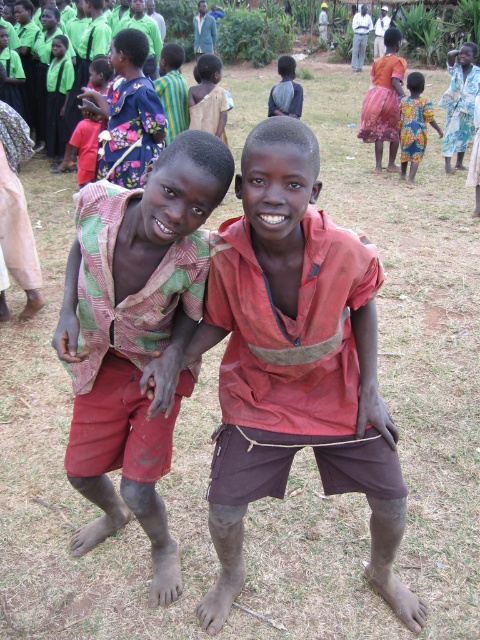
Can you confirm if red matte shirt at center is positioned to the right of multicolored fabric vest at center?

Yes, red matte shirt at center is to the right of multicolored fabric vest at center.

Between red matte shirt at center and multicolored fabric vest at center, which one has more height?

Standing taller between the two is red matte shirt at center.

You are a GUI agent. You are given a task and a screenshot of the screen. Output one action in this format:
    pyautogui.click(x=<x>, y=<y>)
    Task: Click on the red matte shirt at center
    The height and width of the screenshot is (640, 480).
    Given the screenshot: What is the action you would take?
    pyautogui.click(x=296, y=356)

At what (x,y) coordinates should I click in order to perform the action: click on red matte shirt at center. Please return your answer as a coordinate pair (x, y). Image resolution: width=480 pixels, height=640 pixels. Looking at the image, I should click on (296, 356).

Is multicolored fabric vest at center thinner than vibrant floral dress at upper right?

Incorrect, multicolored fabric vest at center's width is not less than vibrant floral dress at upper right's.

Does multicolored fabric vest at center lie behind vibrant floral dress at upper right?

No, multicolored fabric vest at center is closer to the viewer.

I want to click on multicolored fabric vest at center, so click(x=135, y=337).

Can you confirm if vibrant floral dress at upper right is smaller than matte black shirt at upper center?

Yes.

From the picture: Does vibrant floral dress at upper right have a lesser height compared to matte black shirt at upper center?

Correct, vibrant floral dress at upper right is not as tall as matte black shirt at upper center.

The image size is (480, 640). I want to click on vibrant floral dress at upper right, so click(415, 124).

Where is `vibrant floral dress at upper right`? The width and height of the screenshot is (480, 640). vibrant floral dress at upper right is located at coordinates (415, 124).